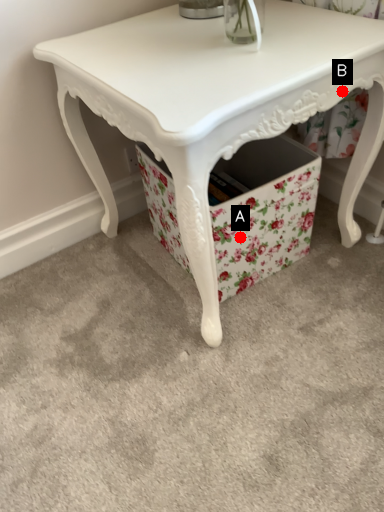
Question: Two points are circled on the image, labeled by A and B beside each circle. Which point is closer to the camera?

Choices:
 (A) A is closer
 (B) B is closer

Answer: (B)